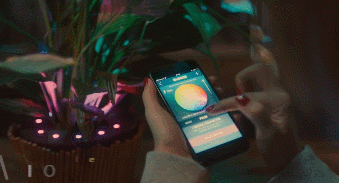
The width and height of the screenshot is (339, 183). What are the coordinates of `table` in the screenshot? It's located at (215, 161).